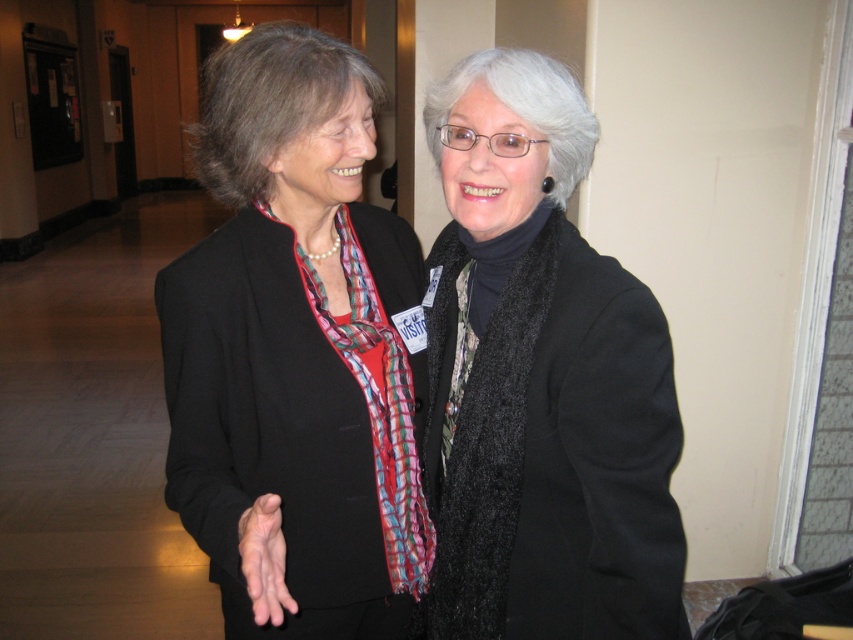
Where is the matte black blazer at center located in the image?

The matte black blazer at center is located at point (294, 353).

You are a fashion designer observing the two items at the center of the image, the matte black blazer at center and the black fuzzy scarf at center. Which one has a greater height?

The matte black blazer at center is taller than the black fuzzy scarf at center.

You are a fashion designer observing two items worn by a person in the image. The items are the matte black blazer at center and the black fuzzy scarf at center. Which item is worn over the other?

The matte black blazer at center is positioned over the black fuzzy scarf at center, so the blazer is worn over the scarf.